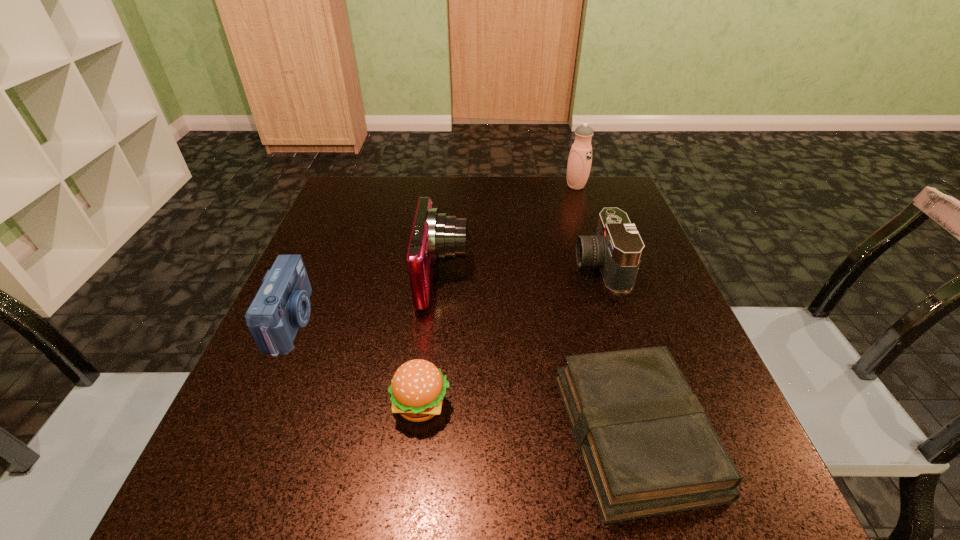
Locate an element on the screen. This screenshot has width=960, height=540. vacant space in between the rightmost camera and the hamburger is located at coordinates (511, 335).

Locate an element on the screen. Image resolution: width=960 pixels, height=540 pixels. empty space that is in between the rightmost camera and the book is located at coordinates (618, 349).

Where is `free spot between the tallest object and the shortest object`? The width and height of the screenshot is (960, 540). free spot between the tallest object and the shortest object is located at coordinates (606, 310).

Where is `free spot between the shortest object and the tallest object`? The image size is (960, 540). free spot between the shortest object and the tallest object is located at coordinates (606, 310).

This screenshot has width=960, height=540. Find the location of `blank region between the rightmost camera and the shortest object`. blank region between the rightmost camera and the shortest object is located at coordinates (618, 349).

Identify the location of empty location between the hamburger and the rightmost camera. The height and width of the screenshot is (540, 960). (511, 335).

Identify the location of vacant area that lies between the leftmost camera and the fifth shortest object. (368, 300).

Where is `vacant area between the shortest object and the leftmost object`? vacant area between the shortest object and the leftmost object is located at coordinates (464, 377).

The image size is (960, 540). I want to click on object that is the fifth nearest to the fifth tallest object, so click(580, 157).

Identify which object is located as the nearest to the shortest object. Please provide its 2D coordinates. Your answer should be formatted as a tuple, i.e. [(x, y)], where the tuple contains the x and y coordinates of a point satisfying the conditions above.

[(418, 387)]